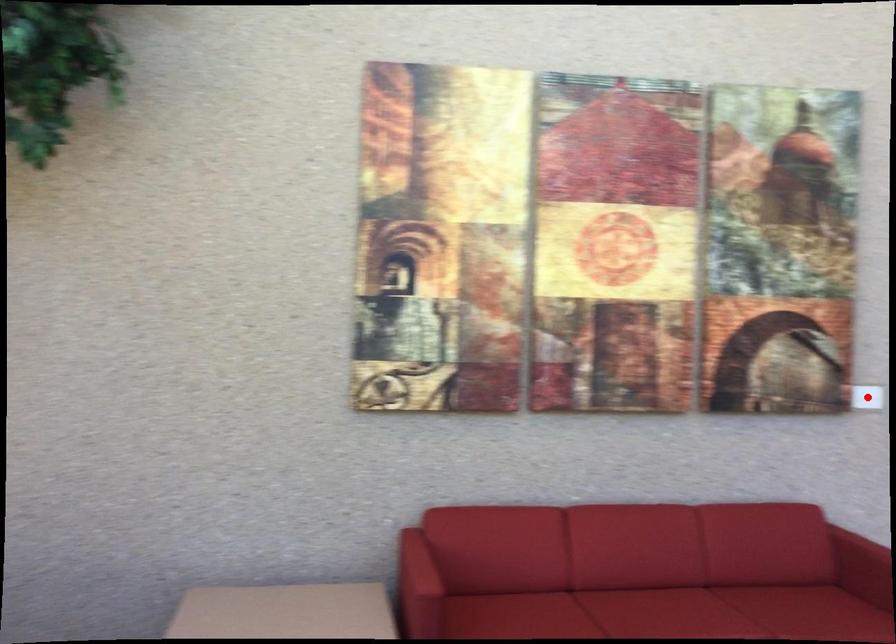
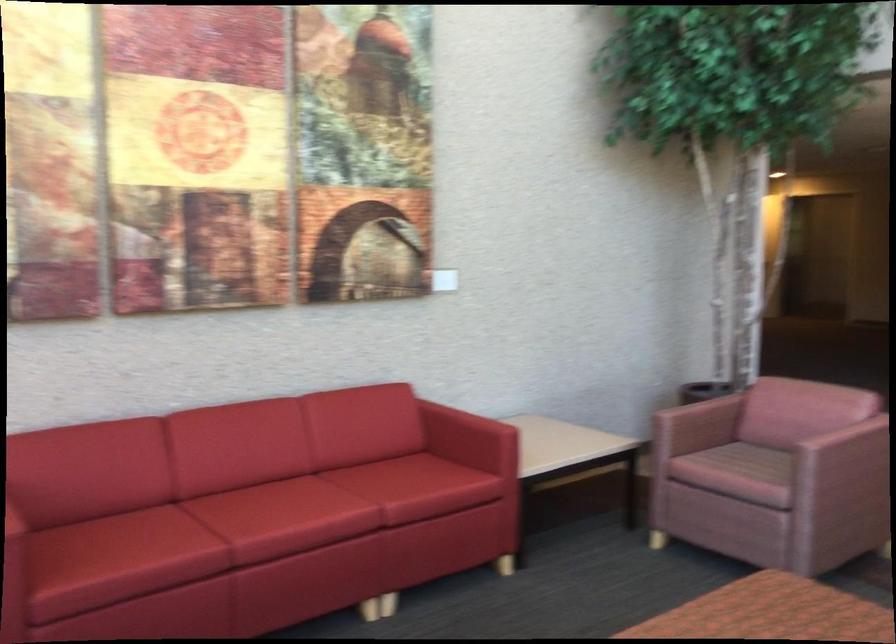
Question: I am providing you with two images of the same scene from different viewpoints. A red point is marked on the first image. Can you still see the location of the red point in image 2?

Choices:
 (A) Yes
 (B) No

Answer: (B)